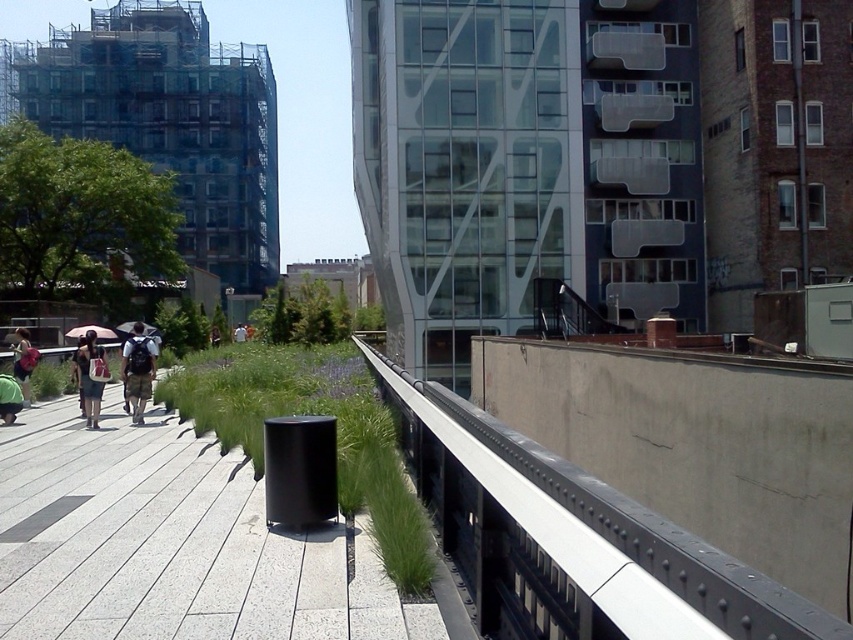
You are standing at the origin point in the image. Where is the metallic gray rail at center located in terms of coordinates?

The metallic gray rail at center is located at coordinates 0.842 in the x direction and 0.672 in the y direction.

You are a delivery person carrying a matte white backpack at left and need to place it on the metallic gray rail at center. The delivery robot you use has a maximum reach of 7 meters. Can the robot place the backpack on the rail?

The metallic gray rail at center is 7.30 meters from the matte white backpack at left. Since the robot can only reach 7 meters, it cannot place the backpack on the rail as the distance exceeds its maximum reach.

From the picture: You are a delivery person who needs to retrieve your pink fabric umbrella at upper left from behind the matte black backpack at center. Is the backpack blocking your direct path to the umbrella?

The matte black backpack at center is in front of the pink fabric umbrella at upper left, so yes, the backpack is blocking the direct path to the umbrella.